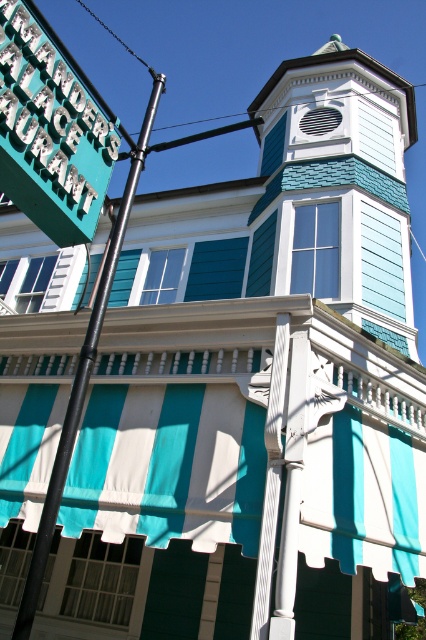
Question: Is white shingled bell tower at upper center above black metal pole at left?

Choices:
 (A) yes
 (B) no

Answer: (B)

Question: Which point is farther from the camera taking this photo?

Choices:
 (A) [x=43, y=173]
 (B) [x=270, y=198]
 (C) [x=20, y=609]

Answer: (B)

Question: Which of these objects is positioned closest to the teal plastic sign at upper left?

Choices:
 (A) white shingled bell tower at upper center
 (B) black metal pole at left

Answer: (B)

Question: Is white shingled bell tower at upper center wider than black metal pole at left?

Choices:
 (A) yes
 (B) no

Answer: (B)

Question: Which point is closer to the camera?

Choices:
 (A) (29, 568)
 (B) (52, 228)

Answer: (A)

Question: Can you confirm if white shingled bell tower at upper center is positioned to the right of teal plastic sign at upper left?

Choices:
 (A) yes
 (B) no

Answer: (A)